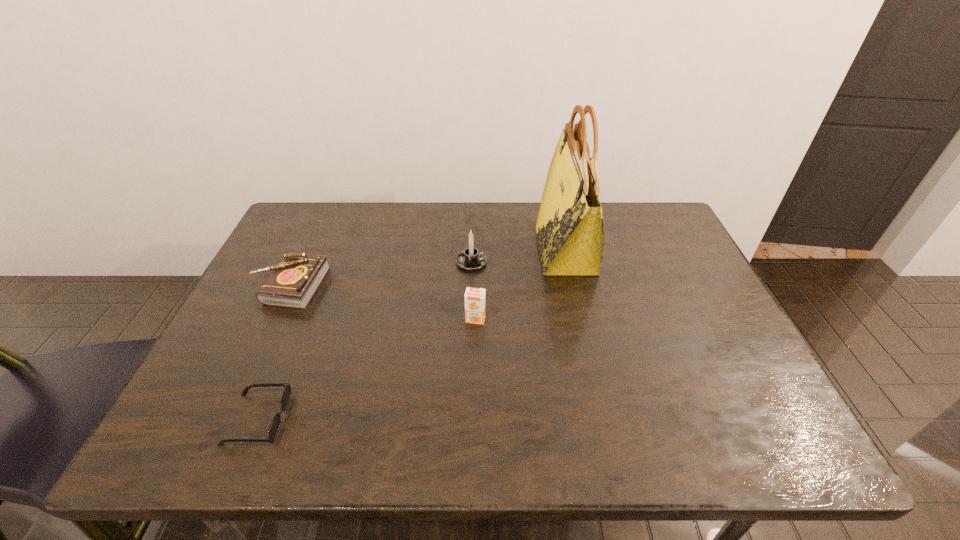
You are a GUI agent. You are given a task and a screenshot of the screen. Output one action in this format:
    pyautogui.click(x=<x>, y=<y>)
    Task: Click on the free space located 0.360m on the front-facing side of the rightmost object
    
    Given the screenshot: What is the action you would take?
    point(417,250)

This screenshot has height=540, width=960. In order to click on vacant space located with a handle on the side of the second tallest object in this screenshot , I will do `click(578, 262)`.

Where is `vacant space located on the front of the second nearest object`? The image size is (960, 540). vacant space located on the front of the second nearest object is located at coordinates pos(474,396).

This screenshot has height=540, width=960. Find the location of `vacant space located on the right of the fourth tallest object`. vacant space located on the right of the fourth tallest object is located at coordinates (361, 286).

Identify the location of vacant space located 0.190m on the front-facing side of the nearest object. (380, 419).

Identify the location of object that is at the far edge. (570, 232).

Where is `object that is positioned at the near edge`? The width and height of the screenshot is (960, 540). object that is positioned at the near edge is located at coordinates click(x=275, y=425).

Where is `diary positioned at the left edge`? The height and width of the screenshot is (540, 960). diary positioned at the left edge is located at coordinates (293, 282).

This screenshot has height=540, width=960. What are the coordinates of `sunglasses that is at the left edge` in the screenshot? It's located at (275, 425).

Locate an element on the screen. object present at the near left corner is located at coordinates (275, 425).